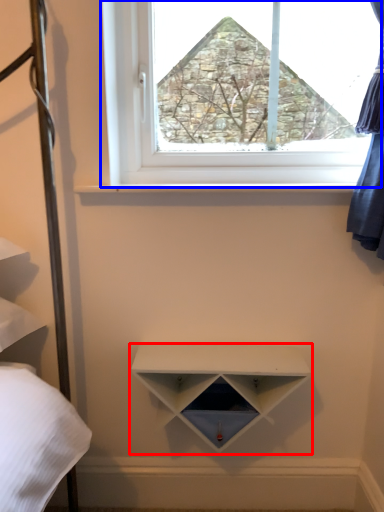
Question: Which object appears closest to the camera in this image, shelf (highlighted by a red box) or window (highlighted by a blue box)?

Choices:
 (A) shelf
 (B) window

Answer: (A)